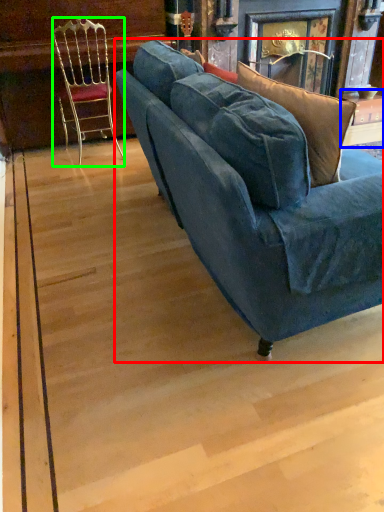
Question: Which is nearer to the studio couch (highlighted by a red box)? table (highlighted by a blue box) or chair (highlighted by a green box).

Choices:
 (A) table
 (B) chair

Answer: (B)